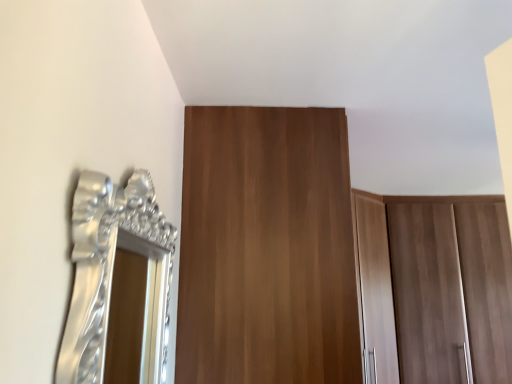
Question: Considering the relative sizes of brown wood door at upper center and silver metallic mirror at left in the image provided, is brown wood door at upper center thinner than silver metallic mirror at left?

Choices:
 (A) no
 (B) yes

Answer: (A)

Question: Can you confirm if brown wood door at upper center is taller than silver metallic mirror at left?

Choices:
 (A) no
 (B) yes

Answer: (B)

Question: Is the position of brown wood door at upper center more distant than that of silver metallic mirror at left?

Choices:
 (A) no
 (B) yes

Answer: (B)

Question: Is brown wood door at upper center not within silver metallic mirror at left?

Choices:
 (A) yes
 (B) no

Answer: (A)

Question: From the image's perspective, does brown wood door at upper center appear lower than silver metallic mirror at left?

Choices:
 (A) no
 (B) yes

Answer: (B)

Question: Is brown wood door at upper center looking in the opposite direction of silver metallic mirror at left?

Choices:
 (A) yes
 (B) no

Answer: (B)

Question: Does silver metallic mirror at left appear on the left side of brown wood door at upper center?

Choices:
 (A) no
 (B) yes

Answer: (B)

Question: Could you tell me if silver metallic mirror at left is facing brown wood door at upper center?

Choices:
 (A) yes
 (B) no

Answer: (B)

Question: Does silver metallic mirror at left have a larger size compared to brown wood door at upper center?

Choices:
 (A) yes
 (B) no

Answer: (B)

Question: Is silver metallic mirror at left turned away from brown wood door at upper center?

Choices:
 (A) no
 (B) yes

Answer: (A)

Question: Can you confirm if silver metallic mirror at left is taller than brown wood door at upper center?

Choices:
 (A) yes
 (B) no

Answer: (B)

Question: From the image's perspective, does silver metallic mirror at left appear higher than brown wood door at upper center?

Choices:
 (A) yes
 (B) no

Answer: (A)

Question: Would you say brown wood door at upper center is to the left or to the right of silver metallic mirror at left in the picture?

Choices:
 (A) right
 (B) left

Answer: (A)